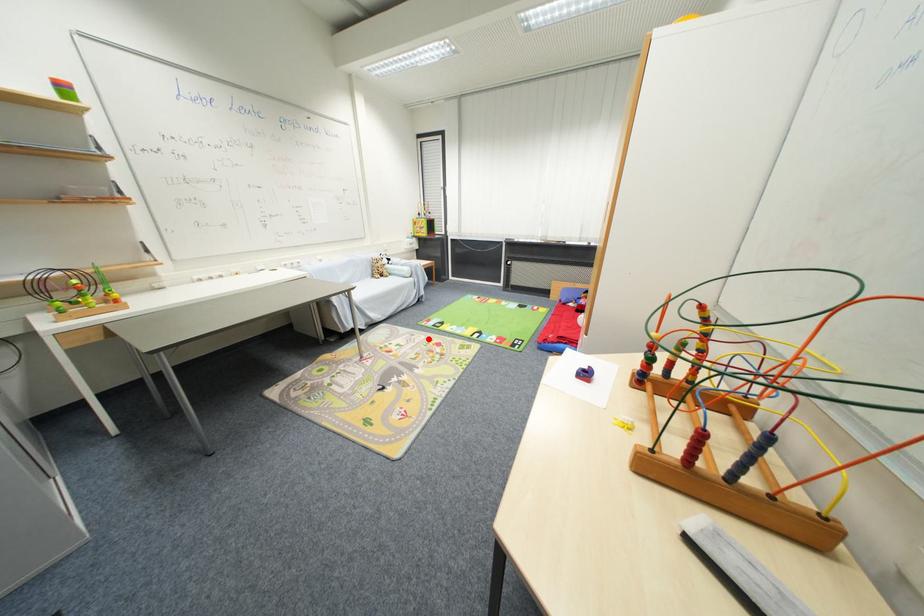
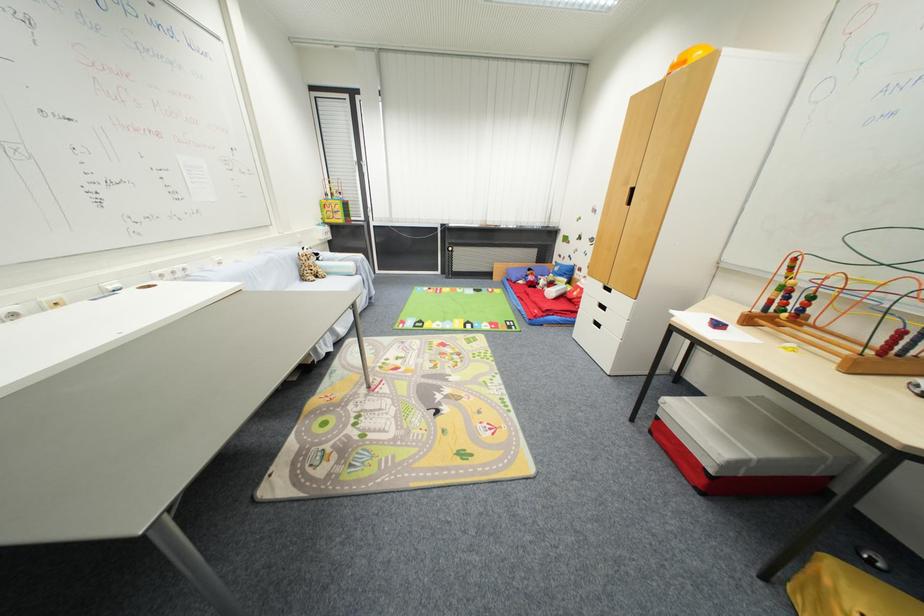
Find the pixel in the second image that matches the highlighted location in the first image.

(423, 342)